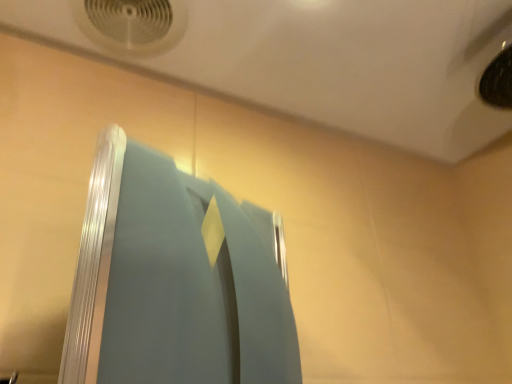
This screenshot has height=384, width=512. What do you see at coordinates (132, 24) in the screenshot? I see `white plastic fan at upper center` at bounding box center [132, 24].

This screenshot has height=384, width=512. Identify the location of white plastic fan at upper center. (132, 24).

In order to click on white plastic fan at upper center in this screenshot , I will do `click(132, 24)`.